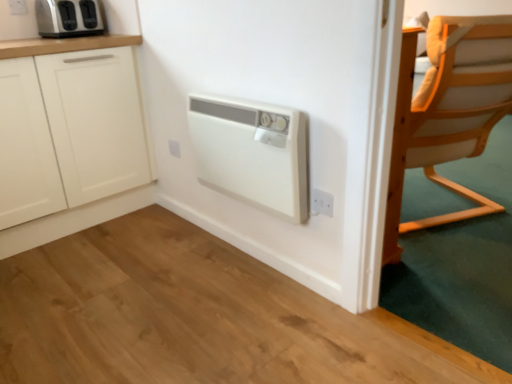
Locate an element on the screen. The image size is (512, 384). white plastic electric outlet at center, the second electric outlet in the bottom-to-top sequence is located at coordinates (174, 148).

This screenshot has height=384, width=512. Describe the element at coordinates (69, 18) in the screenshot. I see `satin silver toaster at upper left` at that location.

This screenshot has width=512, height=384. I want to click on satin silver toaster at upper left, so click(x=69, y=18).

What do you see at coordinates (18, 7) in the screenshot? The image size is (512, 384). I see `white plastic electric outlet at upper left, placed as the 3th electric outlet when sorted from front to back` at bounding box center [18, 7].

In the scene shown: Measure the distance between point (314, 189) and camera.

Point (314, 189) and camera are 5.02 feet apart.

Where is `white plastic electric outlet at center, which is the second electric outlet from back to front`? white plastic electric outlet at center, which is the second electric outlet from back to front is located at coordinates (174, 148).

I want to click on chair in front of the white plastic electric outlet at center, acting as the second electric outlet starting from the front, so click(x=444, y=120).

Is white plastic electric outlet at center, arranged as the 2th electric outlet when viewed from the left, turned away from light wood chair at right?

white plastic electric outlet at center, arranged as the 2th electric outlet when viewed from the left, is not turned away from light wood chair at right.

Based on their positions, is white plastic electric outlet at center, which is the second electric outlet from back to front, located to the left or right of light wood chair at right?

Clearly, white plastic electric outlet at center, which is the second electric outlet from back to front, is on the left of light wood chair at right in the image.

From a real-world perspective, is white plastic electric outlet at center, the second electric outlet in the bottom-to-top sequence, over light wood chair at right?

Incorrect, from a real-world perspective, white plastic electric outlet at center, the second electric outlet in the bottom-to-top sequence, is lower than light wood chair at right.

Does light wood chair at right come in front of white matte cabinet at left?

No, it is not.

How different are the orientations of light wood chair at right and white matte cabinet at left in degrees?

The angle between the facing direction of light wood chair at right and the facing direction of white matte cabinet at left is 159 degrees.

Measure the distance between light wood chair at right and white matte cabinet at left.

light wood chair at right is 1.46 meters away from white matte cabinet at left.

Who is shorter, light wood chair at right or white matte cabinet at left?

Standing shorter between the two is white matte cabinet at left.

Is the depth of satin silver toaster at upper left less than that of light wood chair at right?

No.

Based on the photo, is satin silver toaster at upper left bigger or smaller than light wood chair at right?

satin silver toaster at upper left is smaller than light wood chair at right.

At what (x,y) coordinates should I click in order to perform the action: click on chair lying on the right of satin silver toaster at upper left. Please return your answer as a coordinate pair (x, y). Image resolution: width=512 pixels, height=384 pixels. Looking at the image, I should click on (444, 120).

Can you tell me how much satin silver toaster at upper left and light wood chair at right differ in facing direction?

160 degrees separate the facing orientations of satin silver toaster at upper left and light wood chair at right.

Are light wood chair at right and white plastic electric outlet at lower right, the 1th electric outlet in the bottom-to-top sequence, far apart?

That's not correct — light wood chair at right is a little close to white plastic electric outlet at lower right, the 1th electric outlet in the bottom-to-top sequence.

Which object is further away from the camera taking this photo, light wood chair at right or white plastic electric outlet at lower right, which is counted as the 3th electric outlet, starting from the left?

Positioned behind is light wood chair at right.

From the image's perspective, is light wood chair at right positioned above or below white plastic electric outlet at lower right, acting as the 3th electric outlet starting from the top?

light wood chair at right is above white plastic electric outlet at lower right, acting as the 3th electric outlet starting from the top.

In terms of size, does light wood chair at right appear bigger or smaller than white plastic electric outlet at lower right, which appears as the first electric outlet when viewed from the right?

Clearly, light wood chair at right is larger in size than white plastic electric outlet at lower right, which appears as the first electric outlet when viewed from the right.

Who is smaller, satin silver toaster at upper left or white matte cabinet at left?

satin silver toaster at upper left is smaller.

Is satin silver toaster at upper left taller than white matte cabinet at left?

In fact, satin silver toaster at upper left may be shorter than white matte cabinet at left.

Would you say satin silver toaster at upper left is inside or outside white matte cabinet at left?

satin silver toaster at upper left is spatially situated outside white matte cabinet at left.

In the image, there is a white matte cabinet at left. At what (x,y) coordinates should I click in order to perform the action: click on kitchen appliance above it (from the image's perspective). Please return your answer as a coordinate pair (x, y). Looking at the image, I should click on (69, 18).

Considering the points (19, 11) and (252, 104), which point is in front, point (19, 11) or point (252, 104)?

The point (252, 104) is closer.

Is white plastic electric outlet at upper left, marked as the 3th electric outlet in a right-to-left arrangement, oriented towards white plastic heater at center?

No, white plastic electric outlet at upper left, marked as the 3th electric outlet in a right-to-left arrangement, is not oriented towards white plastic heater at center.

Which object is further away from the camera, white plastic electric outlet at upper left, placed as the 3th electric outlet when sorted from front to back, or white plastic heater at center?

white plastic electric outlet at upper left, placed as the 3th electric outlet when sorted from front to back, is further from the camera.

Are white plastic electric outlet at upper left, which ranks as the 1th electric outlet in back-to-front order, and white plastic heater at center beside each other?

They are not placed beside each other.

Is light wood chair at right behind white plastic heater at center?

That is True.

From the picture: Is light wood chair at right thinner than white plastic heater at center?

Incorrect, the width of light wood chair at right is not less than that of white plastic heater at center.

Can you confirm if light wood chair at right is positioned to the left of white plastic heater at center?

Incorrect, light wood chair at right is not on the left side of white plastic heater at center.

What are the coordinates of `home appliance located on the left of light wood chair at right` in the screenshot? It's located at (252, 153).

Find the location of a particular element. The image size is (512, 384). electric outlet that is the 1st object directly below the light wood chair at right (from a real-world perspective) is located at coordinates [x=174, y=148].

Where is `cabinetry in front of the light wood chair at right`? The width and height of the screenshot is (512, 384). cabinetry in front of the light wood chair at right is located at coordinates (76, 136).

When comparing their distances from white plastic heater at center, does white plastic electric outlet at upper left, acting as the 1th electric outlet starting from the top, or satin silver toaster at upper left seem further?

white plastic electric outlet at upper left, acting as the 1th electric outlet starting from the top.

From the image, which object appears to be farther from white plastic electric outlet at upper left, marked as the 3th electric outlet in a right-to-left arrangement, light wood chair at right or white plastic electric outlet at lower right, the 1th electric outlet in the bottom-to-top sequence?

light wood chair at right is further to white plastic electric outlet at upper left, marked as the 3th electric outlet in a right-to-left arrangement.

Which object lies nearer to the anchor point white plastic electric outlet at center, which ranks as the 2th electric outlet in top-to-bottom order, white plastic electric outlet at upper left, marked as the 3th electric outlet in a right-to-left arrangement, or satin silver toaster at upper left?

satin silver toaster at upper left lies closer to white plastic electric outlet at center, which ranks as the 2th electric outlet in top-to-bottom order, than the other object.

Based on their spatial positions, is white plastic electric outlet at center, arranged as the 2th electric outlet when viewed from the left, or white plastic heater at center further from white matte cabinet at left?

white plastic heater at center is positioned further to the anchor white matte cabinet at left.

Looking at the image, which one is located further to white plastic electric outlet at upper left, which ranks as the 1th electric outlet in left-to-right order, white matte cabinet at left or satin silver toaster at upper left?

Based on the image, white matte cabinet at left appears to be further to white plastic electric outlet at upper left, which ranks as the 1th electric outlet in left-to-right order.

Which object lies nearer to the anchor point white plastic electric outlet at center, arranged as the 2th electric outlet when viewed from the left, white plastic heater at center or white matte cabinet at left?

The object closer to white plastic electric outlet at center, arranged as the 2th electric outlet when viewed from the left, is white matte cabinet at left.

Looking at the image, which one is located further to light wood chair at right, white plastic electric outlet at center, which ranks as the 2th electric outlet in top-to-bottom order, or white plastic electric outlet at lower right, which ranks as the 1th electric outlet in front-to-back order?

white plastic electric outlet at center, which ranks as the 2th electric outlet in top-to-bottom order, lies further to light wood chair at right than the other object.

When comparing their distances from white plastic electric outlet at center, which ranks as the 2th electric outlet in top-to-bottom order, does white plastic electric outlet at upper left, placed as the 3th electric outlet when sorted from front to back, or light wood chair at right seem further?

light wood chair at right is positioned further to the anchor white plastic electric outlet at center, which ranks as the 2th electric outlet in top-to-bottom order.

You are a GUI agent. You are given a task and a screenshot of the screen. Output one action in this format:
    pyautogui.click(x=<x>, y=<y>)
    Task: Click on the kitchen appliance between white plastic electric outlet at upper left, which ranks as the 1th electric outlet in back-to-front order, and white plastic electric outlet at lower right, the 1th electric outlet in the bottom-to-top sequence
    This screenshot has width=512, height=384.
    Given the screenshot: What is the action you would take?
    pyautogui.click(x=69, y=18)

Identify the location of home appliance located between white matte cabinet at left and light wood chair at right in the left-right direction. The height and width of the screenshot is (384, 512). (252, 153).

This screenshot has height=384, width=512. Identify the location of electric outlet between white plastic heater at center and white plastic electric outlet at center, which is the second electric outlet from back to front, from front to back. (321, 203).

Locate an element on the screen. home appliance between white plastic electric outlet at upper left, marked as the 3th electric outlet in a right-to-left arrangement, and white plastic electric outlet at lower right, the 3th electric outlet in the back-to-front sequence, in the horizontal direction is located at coordinates (252, 153).